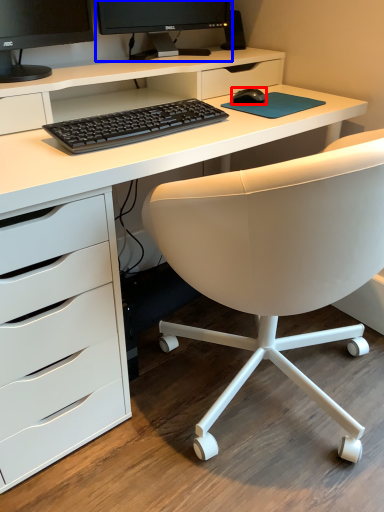
Question: Which object appears closest to the camera in this image, mouse (highlighted by a red box) or computer monitor (highlighted by a blue box)?

Choices:
 (A) mouse
 (B) computer monitor

Answer: (B)